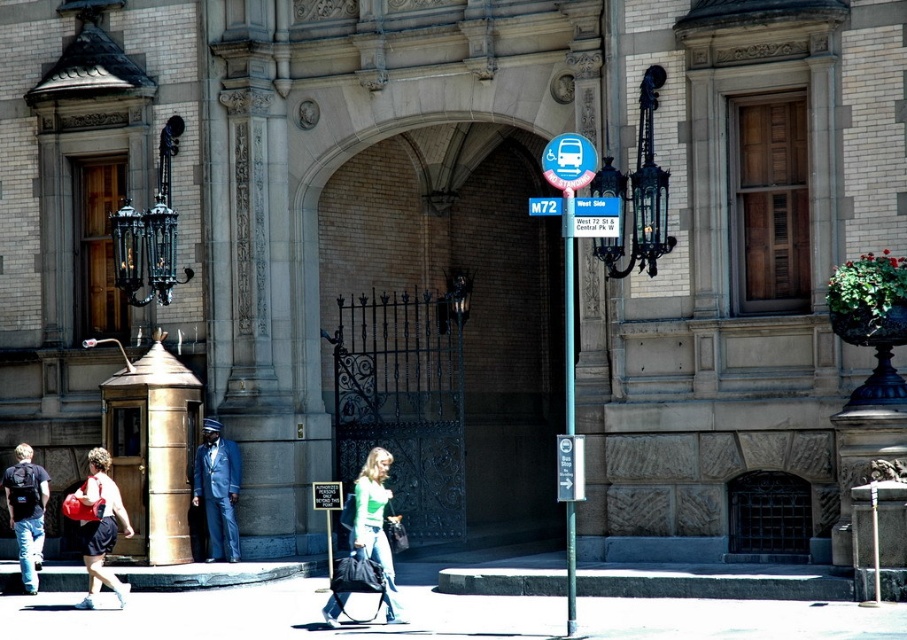
Is matte red bucket at lower left wider than metallic pole at center?

Correct, the width of matte red bucket at lower left exceeds that of metallic pole at center.

Is the position of matte red bucket at lower left more distant than that of metallic pole at center?

Yes, matte red bucket at lower left is behind metallic pole at center.

This screenshot has width=907, height=640. What do you see at coordinates (101, 528) in the screenshot? I see `matte red bucket at lower left` at bounding box center [101, 528].

Locate an element on the screen. The width and height of the screenshot is (907, 640). matte red bucket at lower left is located at coordinates [x=101, y=528].

Which is more to the right, smooth concrete pavement at lower center or green jersey at center?

From the viewer's perspective, green jersey at center appears more on the right side.

Is point (829, 634) positioned before point (375, 476)?

Yes, it is.

Image resolution: width=907 pixels, height=640 pixels. In order to click on smooth concrete pavement at lower center in this screenshot , I will do `click(271, 616)`.

Which is behind, point (218, 499) or point (40, 508)?

The point (218, 499) is more distant.

In order to click on blue fabric suit at center in this screenshot , I will do `click(217, 490)`.